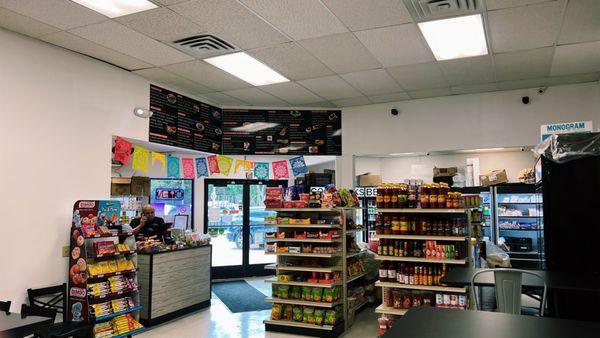
This screenshot has width=600, height=338. In order to click on flourescent lights in this screenshot , I will do `click(467, 37)`, `click(260, 74)`, `click(106, 7)`.